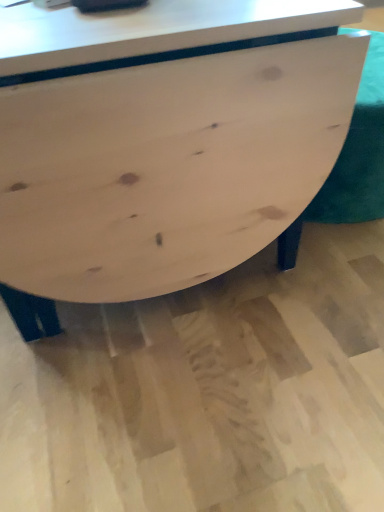
What do you see at coordinates (161, 141) in the screenshot? I see `natural wood table at center` at bounding box center [161, 141].

Where is `natural wood table at center`? This screenshot has width=384, height=512. natural wood table at center is located at coordinates (161, 141).

This screenshot has height=512, width=384. I want to click on natural wood swivel chair at center, so click(351, 164).

Describe the element at coordinates (351, 164) in the screenshot. I see `natural wood swivel chair at center` at that location.

In order to face natural wood swivel chair at center, should I rotate leftwards or rightwards?

Rotate right and turn 19.429 degrees.

Locate an element on the screen. The height and width of the screenshot is (512, 384). natural wood table at center is located at coordinates (161, 141).

Does natural wood swivel chair at center appear on the left side of natural wood table at center?

No, natural wood swivel chair at center is not to the left of natural wood table at center.

Considering their positions, is natural wood swivel chair at center located in front of or behind natural wood table at center?

Visually, natural wood swivel chair at center is located behind natural wood table at center.

Considering the points (381, 71) and (5, 66), which point is in front, point (381, 71) or point (5, 66)?

The point (5, 66) is closer to the camera.

From the image's perspective, which is above, natural wood swivel chair at center or natural wood table at center?

natural wood swivel chair at center.

From a real-world perspective, is natural wood swivel chair at center above or below natural wood table at center?

natural wood swivel chair at center is below natural wood table at center.

Considering the relative sizes of natural wood swivel chair at center and natural wood table at center in the image provided, is natural wood swivel chair at center wider than natural wood table at center?

Incorrect, the width of natural wood swivel chair at center does not surpass that of natural wood table at center.

Considering the relative sizes of natural wood swivel chair at center and natural wood table at center in the image provided, is natural wood swivel chair at center taller than natural wood table at center?

No, natural wood swivel chair at center is not taller than natural wood table at center.

Consider the image. Considering the relative sizes of natural wood swivel chair at center and natural wood table at center in the image provided, is natural wood swivel chair at center smaller than natural wood table at center?

Yes, natural wood swivel chair at center is smaller than natural wood table at center.

Is natural wood swivel chair at center not inside natural wood table at center?

natural wood swivel chair at center is positioned outside natural wood table at center.

Is natural wood swivel chair at center not close to natural wood table at center?

That's not correct — natural wood swivel chair at center is a little close to natural wood table at center.

Is natural wood swivel chair at center oriented towards natural wood table at center?

No, natural wood swivel chair at center is not facing towards natural wood table at center.

How many degrees apart are the facing directions of natural wood swivel chair at center and natural wood table at center?

natural wood swivel chair at center and natural wood table at center are facing 0.000303 degrees away from each other.

This screenshot has height=512, width=384. I want to click on table that appears below the natural wood swivel chair at center (from the image's perspective), so click(161, 141).

In the image, is natural wood table at center on the left side or the right side of natural wood swivel chair at center?

Based on their positions, natural wood table at center is located to the left of natural wood swivel chair at center.

Considering the relative positions of natural wood table at center and natural wood swivel chair at center in the image provided, is natural wood table at center in front of natural wood swivel chair at center?

Yes, natural wood table at center is in front of natural wood swivel chair at center.

Is point (19, 125) closer to camera compared to point (279, 261)?

Yes, point (19, 125) is in front of point (279, 261).

From the image's perspective, is natural wood table at center below natural wood swivel chair at center?

Yes, from the image's perspective, natural wood table at center is below natural wood swivel chair at center.

From a real-world perspective, who is located higher, natural wood table at center or natural wood swivel chair at center?

In real-world perspective, natural wood table at center is above.

From the picture: Does natural wood table at center have a greater width compared to natural wood swivel chair at center?

Indeed, natural wood table at center has a greater width compared to natural wood swivel chair at center.

Can you confirm if natural wood table at center is shorter than natural wood swivel chair at center?

No, natural wood table at center is not shorter than natural wood swivel chair at center.

From the picture: Considering the sizes of objects natural wood table at center and natural wood swivel chair at center in the image provided, who is smaller, natural wood table at center or natural wood swivel chair at center?

natural wood swivel chair at center.

Is natural wood swivel chair at center located within natural wood table at center?

No, natural wood swivel chair at center is not inside natural wood table at center.

From the picture: Are natural wood table at center and natural wood swivel chair at center far apart?

No, there isn't a large distance between natural wood table at center and natural wood swivel chair at center.

Is natural wood swivel chair at center at the back of natural wood table at center?

No.

How many degrees apart are the facing directions of natural wood table at center and natural wood swivel chair at center?

0.000303 degrees separate the facing orientations of natural wood table at center and natural wood swivel chair at center.

At what (x,y) coordinates should I click in order to perform the action: click on swivel chair that appears above the natural wood table at center (from the image's perspective). Please return your answer as a coordinate pair (x, y). The height and width of the screenshot is (512, 384). Looking at the image, I should click on (351, 164).

Where is `table in front of the natural wood swivel chair at center`? This screenshot has height=512, width=384. table in front of the natural wood swivel chair at center is located at coordinates (161, 141).

There is a natural wood swivel chair at center. Identify the location of table above it (from a real-world perspective). This screenshot has width=384, height=512. (161, 141).